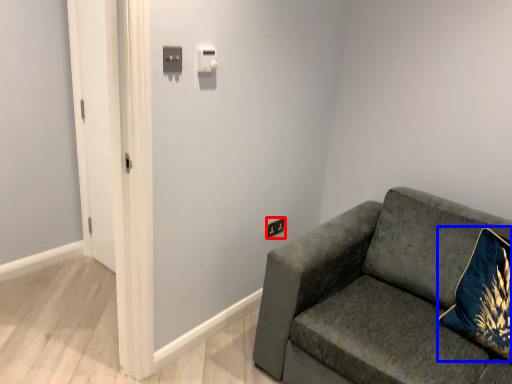
Question: Which object is closer to the camera taking this photo, electric outlet (highlighted by a red box) or throw pillow (highlighted by a blue box)?

Choices:
 (A) electric outlet
 (B) throw pillow

Answer: (B)